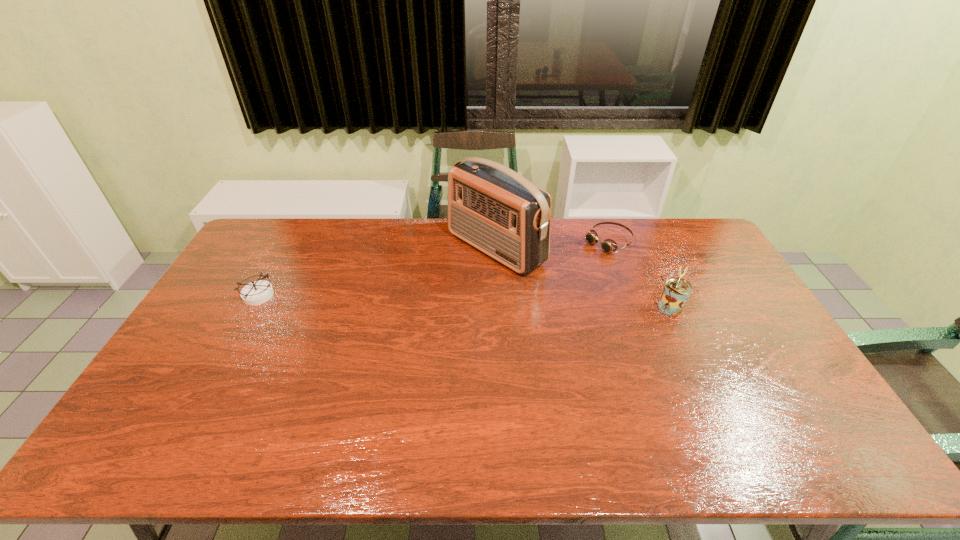
At what (x,y) coordinates should I click in order to perform the action: click on compass. Please return your answer as a coordinate pair (x, y). The height and width of the screenshot is (540, 960). Looking at the image, I should click on (258, 292).

I want to click on the third tallest object, so click(x=258, y=292).

You are a GUI agent. You are given a task and a screenshot of the screen. Output one action in this format:
    pyautogui.click(x=<x>, y=<y>)
    Task: Click on the can
    
    Given the screenshot: What is the action you would take?
    pyautogui.click(x=676, y=292)

This screenshot has height=540, width=960. I want to click on goggles, so click(x=608, y=245).

I want to click on radio receiver, so click(491, 207).

Identify the location of the tallest object. This screenshot has height=540, width=960. (491, 207).

I want to click on vacant area located on the right of the third tallest object, so click(x=294, y=296).

The width and height of the screenshot is (960, 540). Identify the location of free space located on the front of the can. click(703, 373).

At what (x,y) coordinates should I click in order to perform the action: click on vacant space located 0.250m through the lenses of the shortest object. Please return your answer as a coordinate pair (x, y). Looking at the image, I should click on (547, 281).

Find the location of `vacant space located through the lenses of the shortest object`. vacant space located through the lenses of the shortest object is located at coordinates (574, 264).